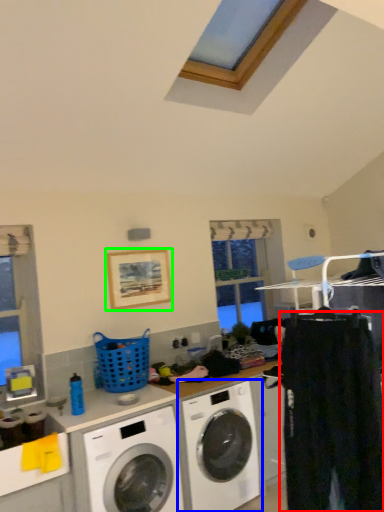
Question: Based on their relative distances, which object is nearer to clothing (highlighted by a red box)? Choose from washing machine (highlighted by a blue box) and picture frame (highlighted by a green box).

Choices:
 (A) washing machine
 (B) picture frame

Answer: (A)